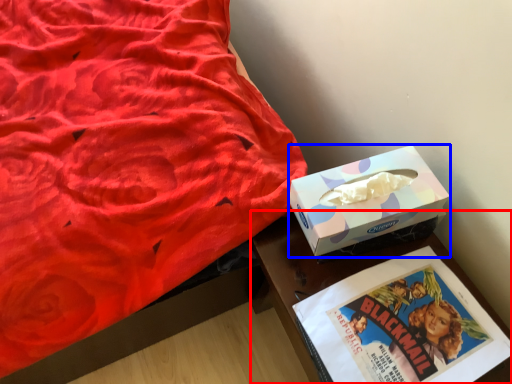
Question: Which point is closer to the camera, table (highlighted by a red box) or box (highlighted by a blue box)?

Choices:
 (A) table
 (B) box

Answer: (A)